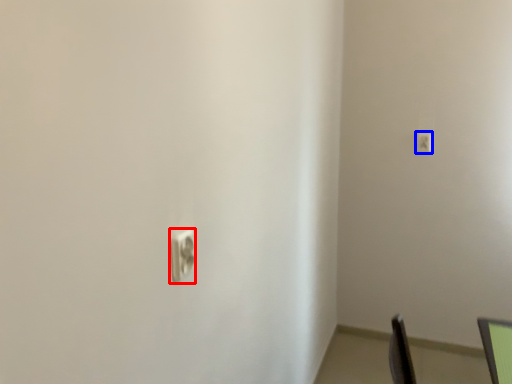
Question: Which object appears closest to the camera in this image, light switch (highlighted by a red box) or light switch (highlighted by a blue box)?

Choices:
 (A) light switch
 (B) light switch

Answer: (A)